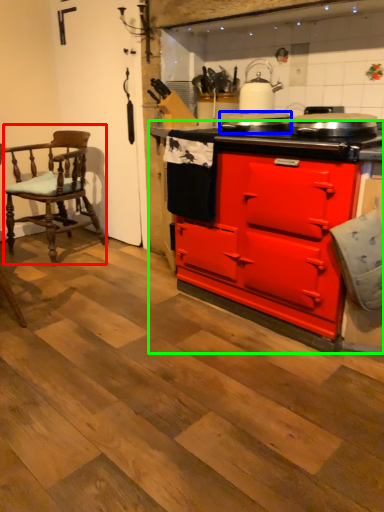
Question: Considering the real-world distances, which object is closest to chair (highlighted by a red box)? appliance (highlighted by a blue box) or cabinetry (highlighted by a green box).

Choices:
 (A) appliance
 (B) cabinetry

Answer: (B)